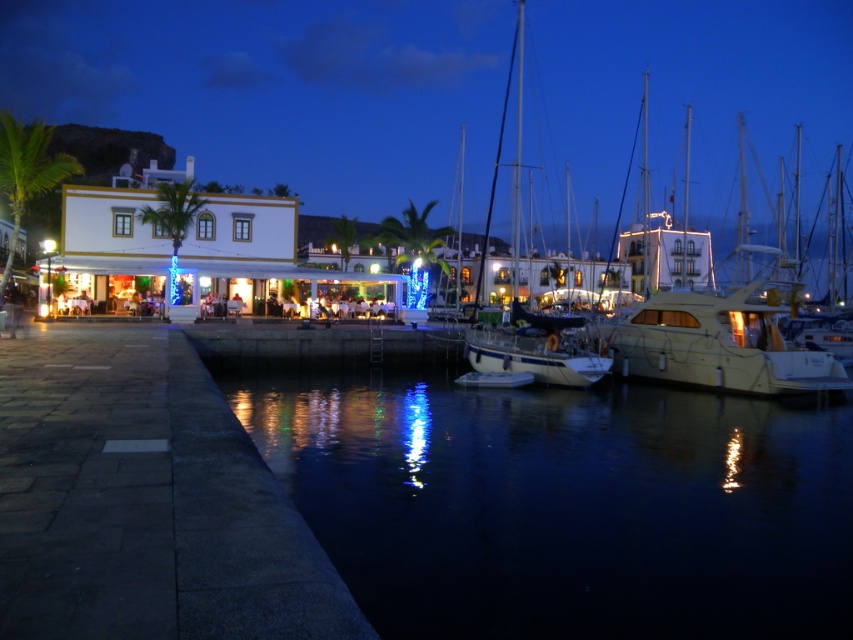
Between dark reflective water at lower center and matte yellow boat at right, which one is positioned higher?

Positioned higher is matte yellow boat at right.

Can you confirm if dark reflective water at lower center is taller than matte yellow boat at right?

Yes.

Who is more forward, (566, 506) or (689, 330)?

Point (566, 506) is more forward.

In order to click on dark reflective water at lower center in this screenshot , I will do `click(566, 504)`.

Is matte yellow boat at right to the left of white glossy sailboat at center from the viewer's perspective?

Yes, matte yellow boat at right is to the left of white glossy sailboat at center.

What are the coordinates of `matte yellow boat at right` in the screenshot? It's located at (721, 342).

What are the coordinates of `matte yellow boat at right` in the screenshot? It's located at (721, 342).

Which is behind, point (721, 461) or point (517, 33)?

Positioned behind is point (517, 33).

Where is `dark reflective water at lower center`? dark reflective water at lower center is located at coordinates (566, 504).

What are the coordinates of `dark reflective water at lower center` in the screenshot? It's located at (566, 504).